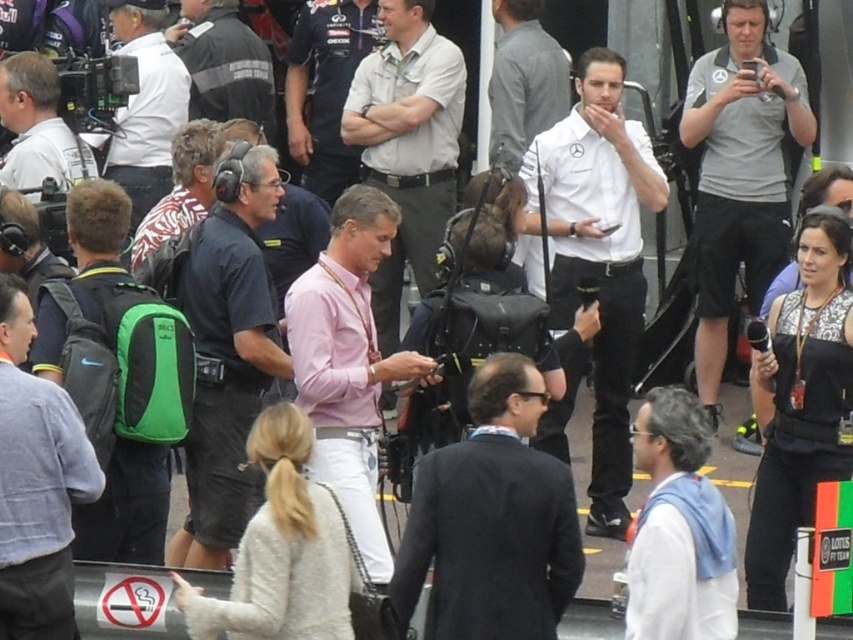
Who is higher up, pink cotton shirt at center or dark gray jacket at center?

dark gray jacket at center is above.

This screenshot has height=640, width=853. Find the location of `pink cotton shirt at center`. pink cotton shirt at center is located at coordinates (347, 362).

The height and width of the screenshot is (640, 853). Identify the location of pink cotton shirt at center. (347, 362).

Locate an element on the screen. This screenshot has width=853, height=640. pink cotton shirt at center is located at coordinates (347, 362).

Is white matte shirt at center bigger than dark gray jacket at center?

Yes, white matte shirt at center is bigger than dark gray jacket at center.

Does point (608, 440) come behind point (218, 52)?

No, (608, 440) is closer to viewer.

From the picture: Who is more distant from viewer, (577, 246) or (229, 97)?

Positioned behind is point (229, 97).

Find the location of a particular element. white matte shirt at center is located at coordinates (598, 253).

Does denim shirt at left have a larger size compared to white shirt at center?

Correct, denim shirt at left is larger in size than white shirt at center.

Which is more to the right, denim shirt at left or white shirt at center?

From the viewer's perspective, white shirt at center appears more on the right side.

Identify the location of denim shirt at left. The width and height of the screenshot is (853, 640). (36, 483).

Locate an element on the screen. Image resolution: width=853 pixels, height=640 pixels. denim shirt at left is located at coordinates (36, 483).